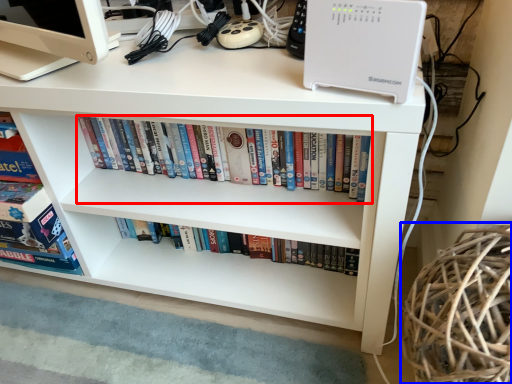
Question: Which point is further to the camera, book (highlighted by a red box) or basket (highlighted by a blue box)?

Choices:
 (A) book
 (B) basket

Answer: (A)